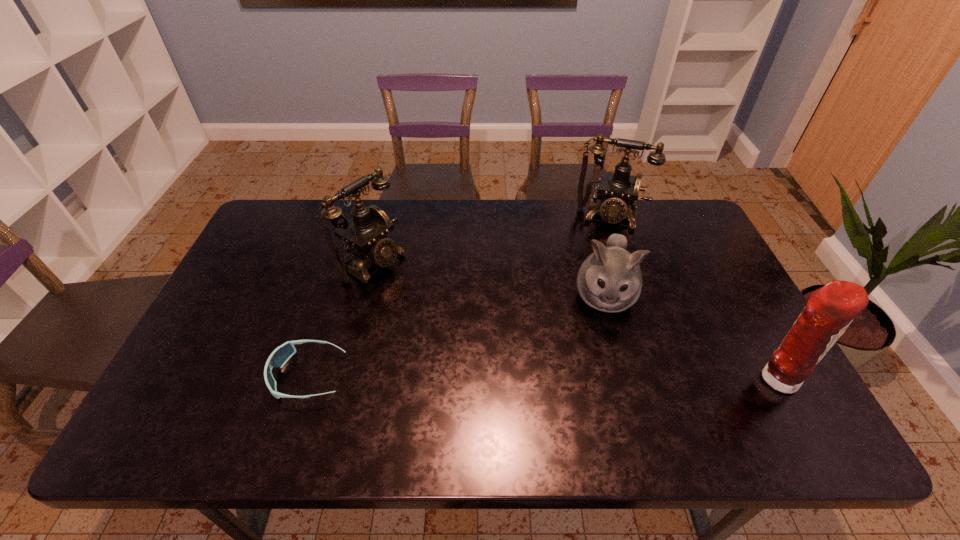
Where is `free point between the shortest object and the right telephone`? The width and height of the screenshot is (960, 540). free point between the shortest object and the right telephone is located at coordinates (458, 296).

Locate an element on the screen. The height and width of the screenshot is (540, 960). free space between the farther telephone and the shortest object is located at coordinates (458, 296).

Where is `vacant area that lies between the nearer telephone and the second shortest object`? The height and width of the screenshot is (540, 960). vacant area that lies between the nearer telephone and the second shortest object is located at coordinates (488, 280).

Where is `free space between the goggles and the rightmost object`? The image size is (960, 540). free space between the goggles and the rightmost object is located at coordinates (542, 377).

Where is `vacant area that lies between the hamster and the goggles`? vacant area that lies between the hamster and the goggles is located at coordinates (456, 336).

Where is `free space between the rightmost object and the left telephone`? This screenshot has width=960, height=540. free space between the rightmost object and the left telephone is located at coordinates (574, 320).

Locate which object is the closest to the shortest object. Please provide its 2D coordinates. Your answer should be formatted as a tuple, i.e. [(x, y)], where the tuple contains the x and y coordinates of a point satisfying the conditions above.

[(365, 235)]

Identify which object is located as the second nearest to the nearer telephone. Please provide its 2D coordinates. Your answer should be formatted as a tuple, i.e. [(x, y)], where the tuple contains the x and y coordinates of a point satisfying the conditions above.

[(610, 280)]